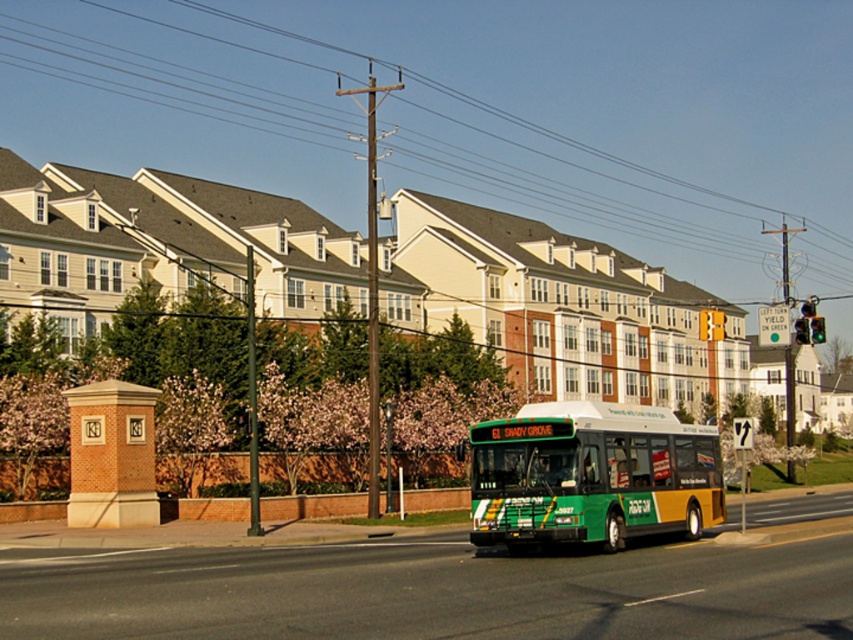
Question: Is green matte bus at center further to camera compared to green glass traffic light at center right?

Choices:
 (A) yes
 (B) no

Answer: (B)

Question: Is green glass traffic light at center right smaller than metallic green traffic light at center right?

Choices:
 (A) yes
 (B) no

Answer: (B)

Question: Which of the following is the closest to the observer?

Choices:
 (A) (498, 449)
 (B) (657, 13)
 (C) (816, 330)
 (D) (720, 312)

Answer: (A)

Question: Which point is closer to the camera?

Choices:
 (A) (811, 336)
 (B) (796, 333)
 (C) (573, 513)

Answer: (C)

Question: Does green glass traffic light at center have a lesser width compared to metallic green traffic light at center right?

Choices:
 (A) yes
 (B) no

Answer: (B)

Question: Which object appears farthest from the camera in this image?

Choices:
 (A) green matte bus at center
 (B) green glass traffic light at center
 (C) metallic green traffic light at center right

Answer: (C)